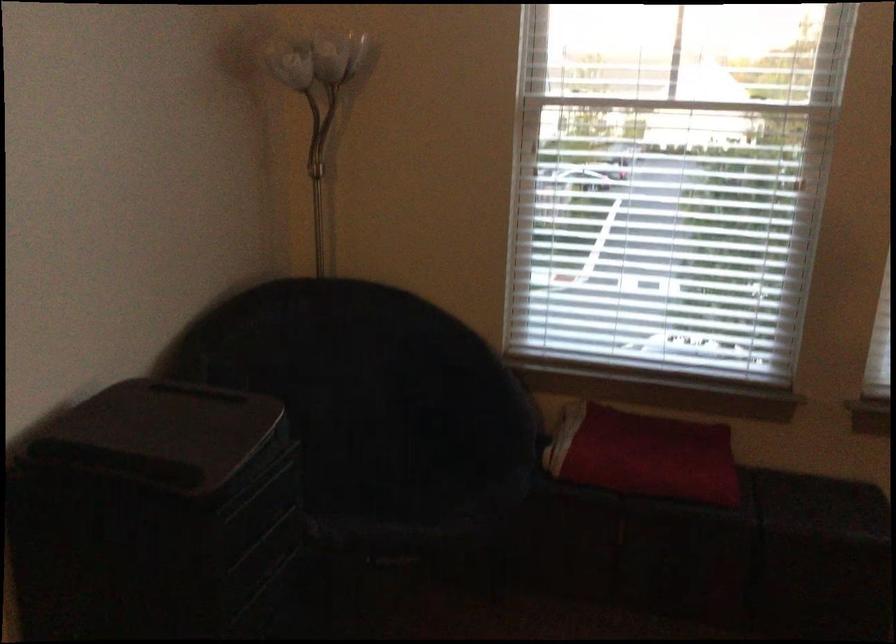
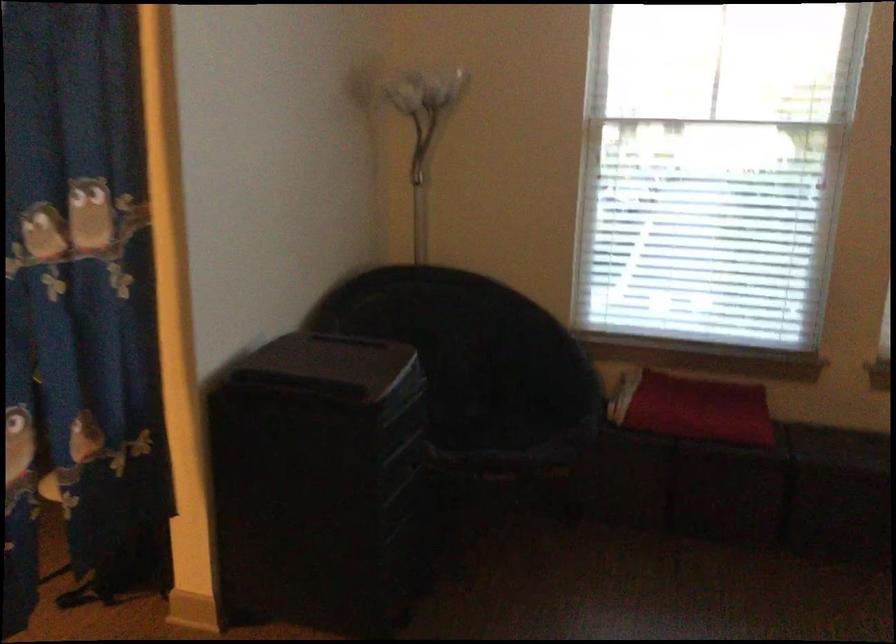
Question: How did the camera likely rotate?

Choices:
 (A) Left
 (B) Right
 (C) Up
 (D) Down

Answer: (A)